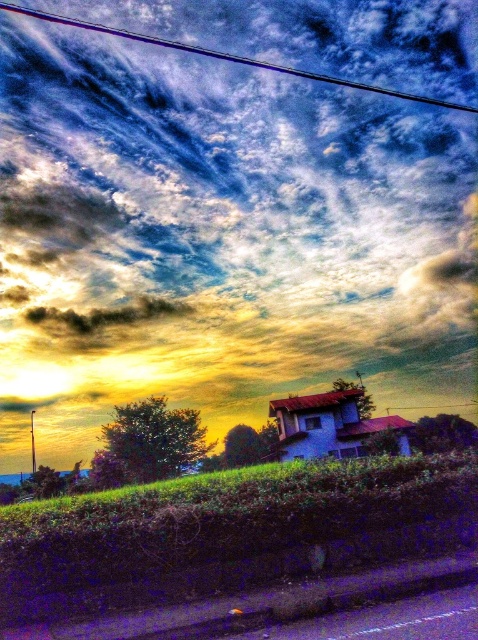
Can you confirm if cloudy sky at upper center is positioned below metallic wire at upper center?

Yes.

Is point (410, 241) closer to camera compared to point (449, 102)?

No, (410, 241) is further to viewer.

The width and height of the screenshot is (478, 640). In order to click on cloudy sky at upper center in this screenshot , I will do `click(223, 186)`.